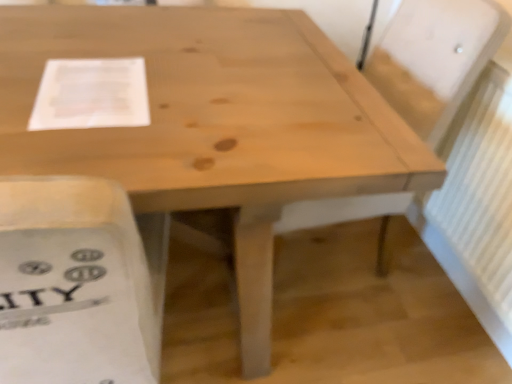
Question: Relative to white textured radiator at right, is white paper at upper left in front or behind?

Choices:
 (A) behind
 (B) front

Answer: (B)

Question: Is white paper at upper left inside the boundaries of white textured radiator at right, or outside?

Choices:
 (A) outside
 (B) inside

Answer: (A)

Question: Considering the positions of white paper at upper left and white textured radiator at right in the image, is white paper at upper left taller or shorter than white textured radiator at right?

Choices:
 (A) short
 (B) tall

Answer: (A)

Question: Is white textured radiator at right in front of or behind white paper at upper left in the image?

Choices:
 (A) behind
 (B) front

Answer: (A)

Question: Choose the correct answer: Is white textured radiator at right inside white paper at upper left or outside it?

Choices:
 (A) outside
 (B) inside

Answer: (A)

Question: Does point (506, 97) appear closer or farther from the camera than point (61, 104)?

Choices:
 (A) farther
 (B) closer

Answer: (A)

Question: Considering the positions of white textured radiator at right and white paper at upper left in the image, is white textured radiator at right bigger or smaller than white paper at upper left?

Choices:
 (A) big
 (B) small

Answer: (A)